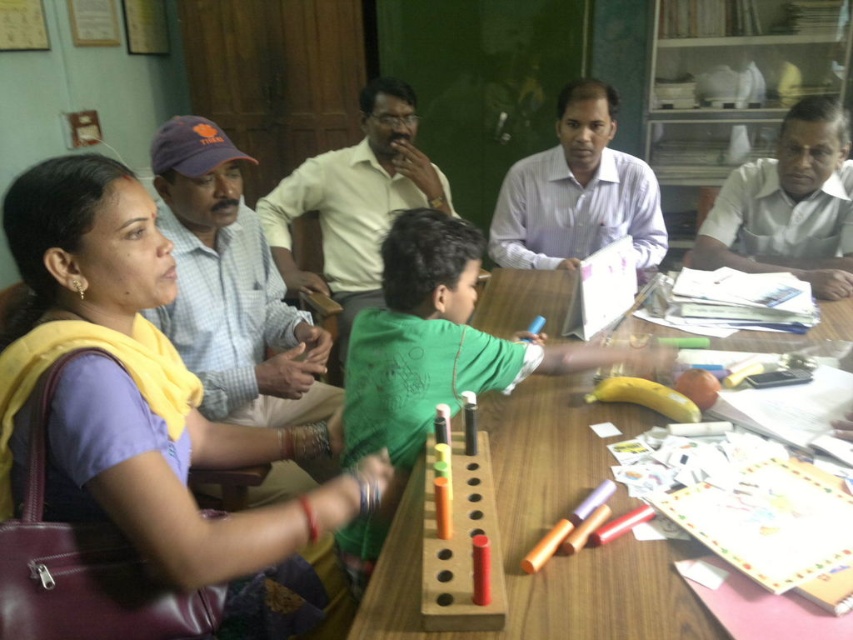
You are a teacher observing a classroom scene. You notice the wooden at center and the light yellow shirt at center. Which object is closer to you from your viewpoint?

The wooden at center is closer to you because it is in front of the light yellow shirt at center.

From the picture: You are a photographer standing in front of the wooden table. You need to capture a photo that includes both the light yellow shirt at center and the white glossy shirt at upper right. Based on their heights, which shirt should you adjust to ensure both are fully visible in the frame?

The light yellow shirt at center is taller than the white glossy shirt at upper right, so you should lower the camera angle or adjust the lighting to ensure the taller light yellow shirt at center does not block the view of the shorter white glossy shirt at upper right.